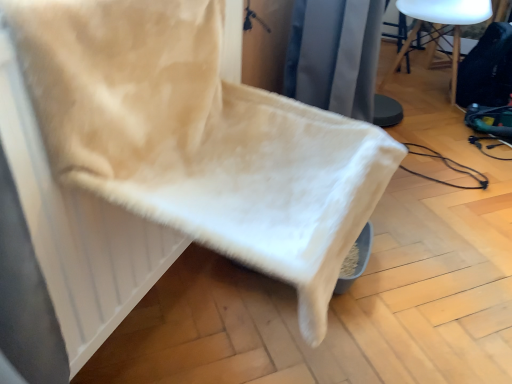
Identify the location of vacant space underneath black fabric chair at upper right (from a real-world perspective). (416, 88).